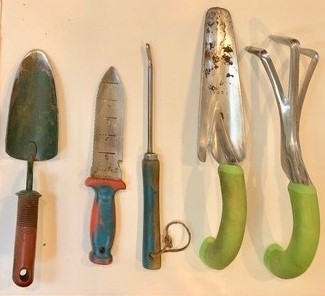
Identify the location of handle. This screenshot has width=325, height=296. point(230,237).